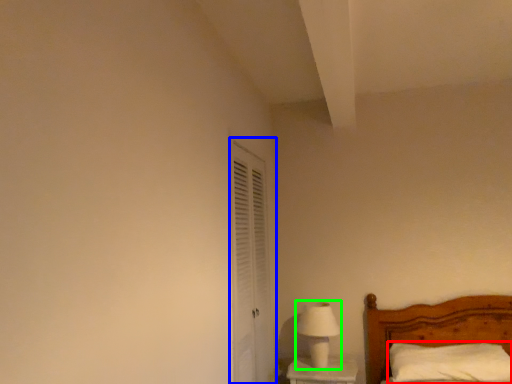
Question: Which object is positioned farthest from pillow (highlighted by a red box)? Select from screen door (highlighted by a blue box) and table lamp (highlighted by a green box).

Choices:
 (A) screen door
 (B) table lamp

Answer: (A)